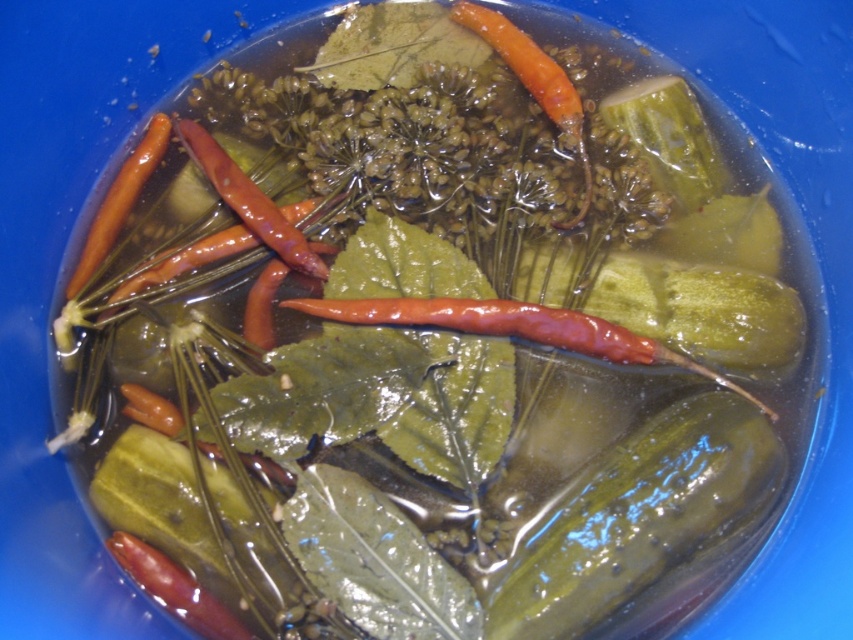
Question: Is green glossy pickle at center below orange glossy carrot at center?

Choices:
 (A) yes
 (B) no

Answer: (A)

Question: Which point is farther to the camera?

Choices:
 (A) green glossy pickle at center
 (B) orange glossy carrot at center

Answer: (B)

Question: Which object appears closest to the camera in this image?

Choices:
 (A) bright orange carrot at center
 (B) green glossy pickle at center
 (C) orange glossy carrot at upper left
 (D) orange glossy carrot at center

Answer: (B)

Question: Which point is farther from the camera taking this photo?

Choices:
 (A) (701, 538)
 (B) (132, 170)
 (C) (256, 195)
 (D) (524, 70)

Answer: (D)

Question: Is orange glossy carrot at center above orange glossy carrot at upper left?

Choices:
 (A) no
 (B) yes

Answer: (B)

Question: Is orange glossy carrot at center below orange glossy carrot at upper left?

Choices:
 (A) no
 (B) yes

Answer: (A)